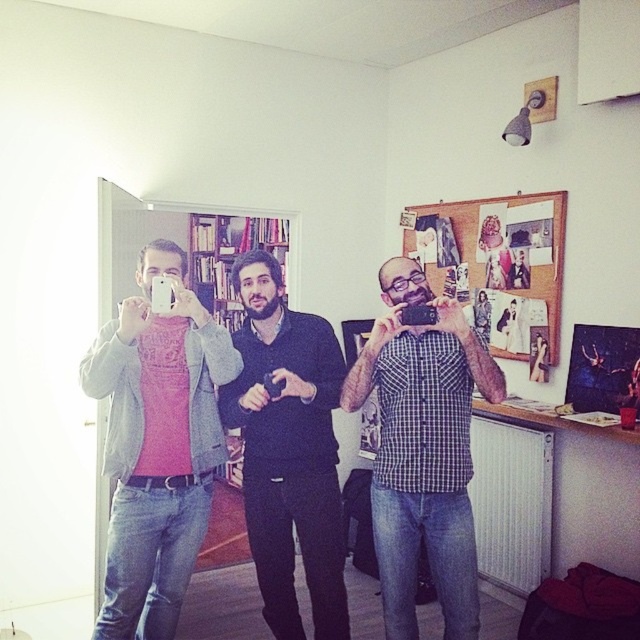
You are organizing a group photo shoot and need to arrange the participants based on their clothing colors. Given the pink matte shirt at center and the dark blue sweater at center, which clothing item is located to the left when viewed from the front?

The pink matte shirt at center is positioned on the left side of the dark blue sweater at center, so the pink matte shirt at center is located to the left.

Looking at the three men taking selfies in the scene, which of the two items, the checkered fabric shirt at center or the dark blue sweater at center, is positioned to the right?

The checkered fabric shirt at center is positioned to the right of the dark blue sweater at center.

You are organizing a photo shoot and need to arrange the checkered fabric shirt at center and the dark blue sweater at center based on their widths. Which one should you place first if you want to start with the wider item?

The checkered fabric shirt at center is wider than the dark blue sweater at center, so you should place the checkered fabric shirt at center first.